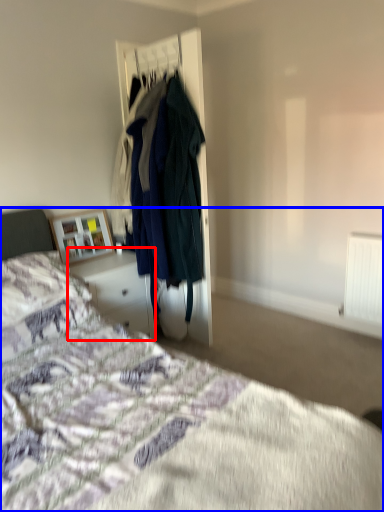
Question: Which object appears farthest to the camera in this image, vanity (highlighted by a red box) or bed (highlighted by a blue box)?

Choices:
 (A) vanity
 (B) bed

Answer: (A)